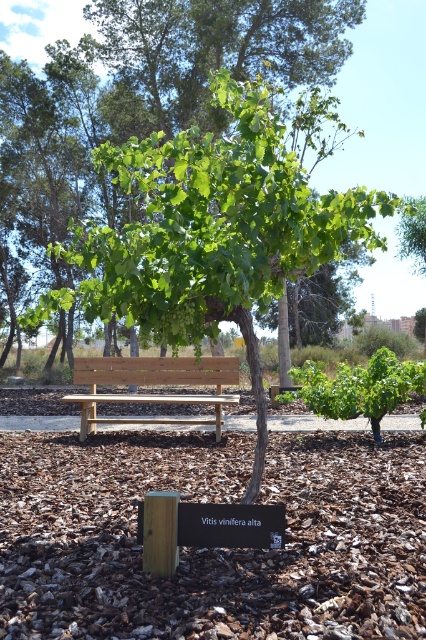
You are a gardener who needs to water the green leafy tree at center and the wooden bench at center. The watering can you have can only reach 3 meters. Can you water both from your current position without moving?

The green leafy tree at center is 4.08 meters from wooden bench at center. Since the watering can can only reach 3 meters, you cannot water both from your current position without moving, as the distance between them exceeds the reach of the watering can.

You are a visitor sitting on the wooden bench at center and want to pick grapes from the green leafy tree at center. Can you reach the grapes without leaving the bench?

The green leafy tree at center is positioned on the right side of wooden bench at center. Since the tree is to your right, you can reach the grapes from the bench by extending your arm towards the right side.